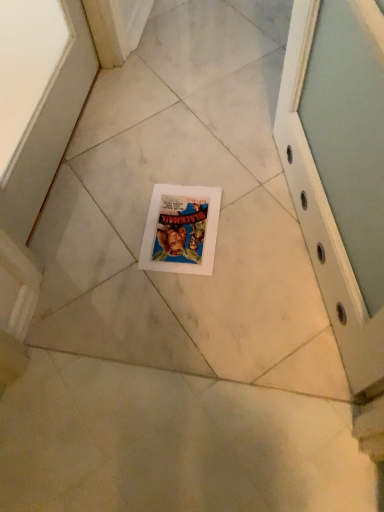
At what (x,y) coordinates should I click in order to perform the action: click on vacant space behind white paper comic book at center. Please return your answer as a coordinate pair (x, y). This screenshot has width=384, height=512. Looking at the image, I should click on (171, 161).